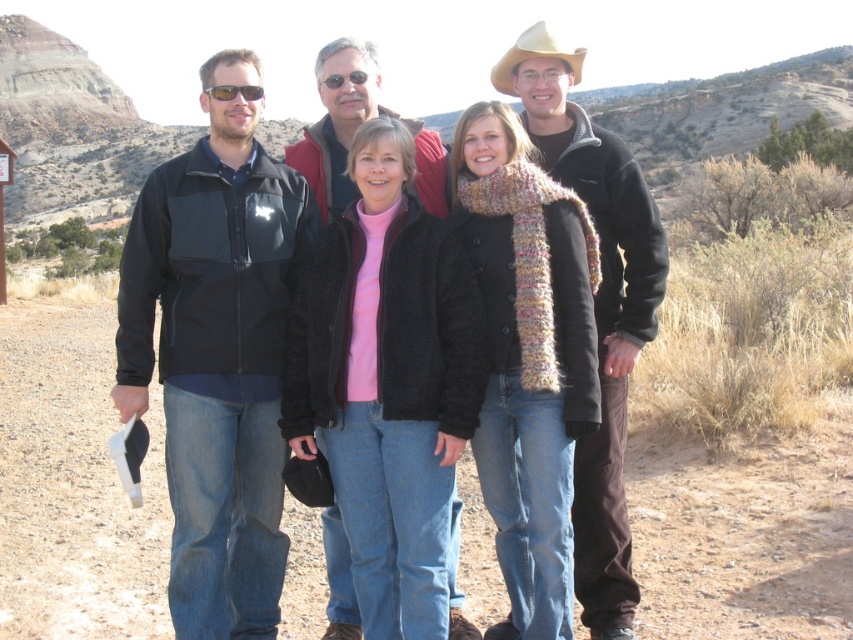
You are standing in the desert scene and want to walk from point A to point B. Point A is at coordinates point (x=47, y=460) and point B is at coordinates point (x=213, y=97). Which direction should you face to walk towards point B from point A?

To walk from point A to point B, you should face towards the lower right direction since point A is further to the viewer than point B, meaning point B is located behind and to the right of point A.

You are standing at point (227, 100) and want to walk to point (573, 81). Is the destination point behind you or in front of you?

The destination point (573, 81) is behind the starting point (227, 100), so it is behind you.